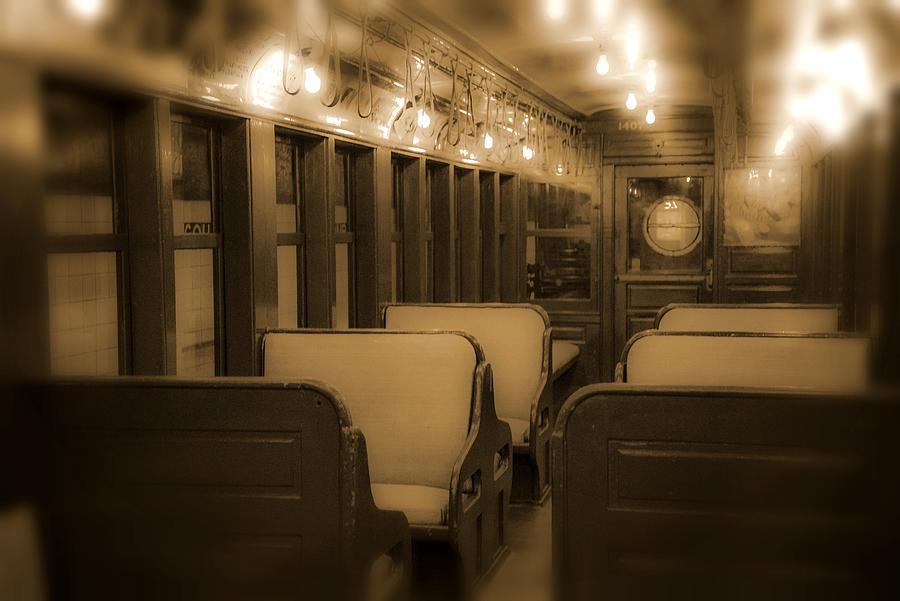
You are a GUI agent. You are given a task and a screenshot of the screen. Output one action in this format:
    pyautogui.click(x=<x>, y=<y>)
    Task: Click on the bench back
    The image size is (900, 601).
    Given the screenshot: What is the action you would take?
    pyautogui.click(x=239, y=483), pyautogui.click(x=699, y=505)